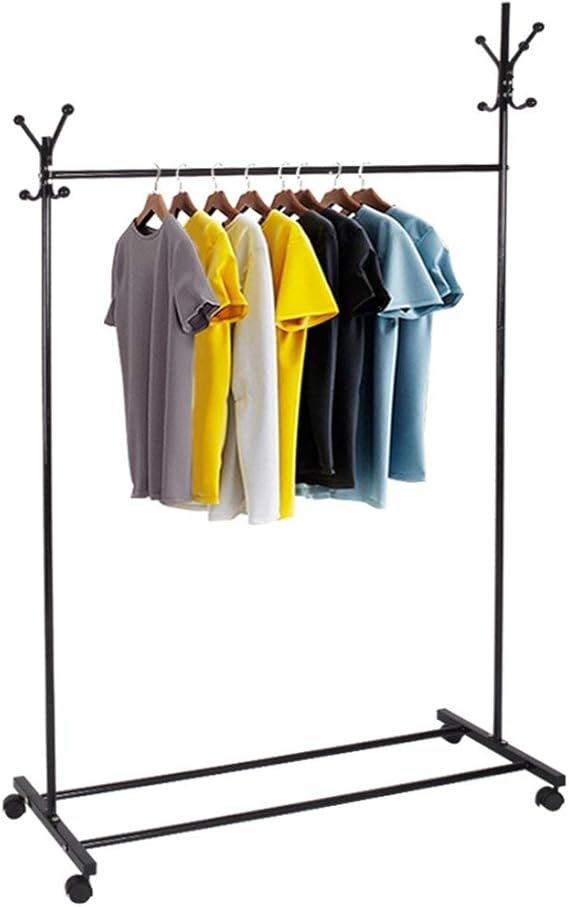
Find the location of `wire hook on clothes hanger`. wire hook on clothes hanger is located at coordinates (158, 171), (178, 166), (213, 171), (249, 171), (279, 171), (298, 169), (340, 171), (362, 171).